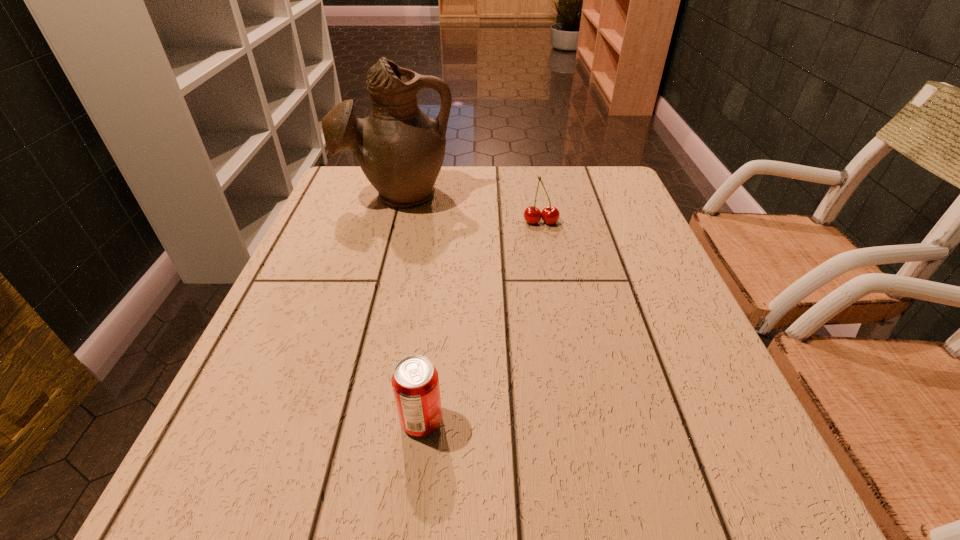
The height and width of the screenshot is (540, 960). In order to click on free space between the tallest object and the rightmost object in this screenshot , I will do `click(469, 208)`.

Identify the location of unoccupied area between the pitcher and the nearest object. (410, 307).

You are a GUI agent. You are given a task and a screenshot of the screen. Output one action in this format:
    pyautogui.click(x=<x>, y=<y>)
    Task: Click on the empty space between the rightmost object and the tallest object
    This screenshot has width=960, height=540.
    Given the screenshot: What is the action you would take?
    pyautogui.click(x=469, y=208)

Where is `unoccupied area between the pitcher and the rightmost object`? The width and height of the screenshot is (960, 540). unoccupied area between the pitcher and the rightmost object is located at coordinates (469, 208).

Identify the location of vacant space in between the tallest object and the soda. Image resolution: width=960 pixels, height=540 pixels. (410, 307).

Identify which object is the second closest to the soda. Please provide its 2D coordinates. Your answer should be formatted as a tuple, i.e. [(x, y)], where the tuple contains the x and y coordinates of a point satisfying the conditions above.

[(400, 149)]

Identify which object is the nearest to the nearest object. Please provide its 2D coordinates. Your answer should be formatted as a tuple, i.e. [(x, y)], where the tuple contains the x and y coordinates of a point satisfying the conditions above.

[(550, 215)]

The height and width of the screenshot is (540, 960). I want to click on free point that satisfies the following two spatial constraints: 1. at the spout of the tallest object; 2. on the right side of the nearest object, so click(x=338, y=421).

Where is `blank space that satisfies the following two spatial constraints: 1. at the spout of the tallest object; 2. on the right side of the soda`? blank space that satisfies the following two spatial constraints: 1. at the spout of the tallest object; 2. on the right side of the soda is located at coordinates (338, 421).

Identify the location of free spot that satisfies the following two spatial constraints: 1. at the spout of the pitcher; 2. on the left side of the soda. The image size is (960, 540). (338, 421).